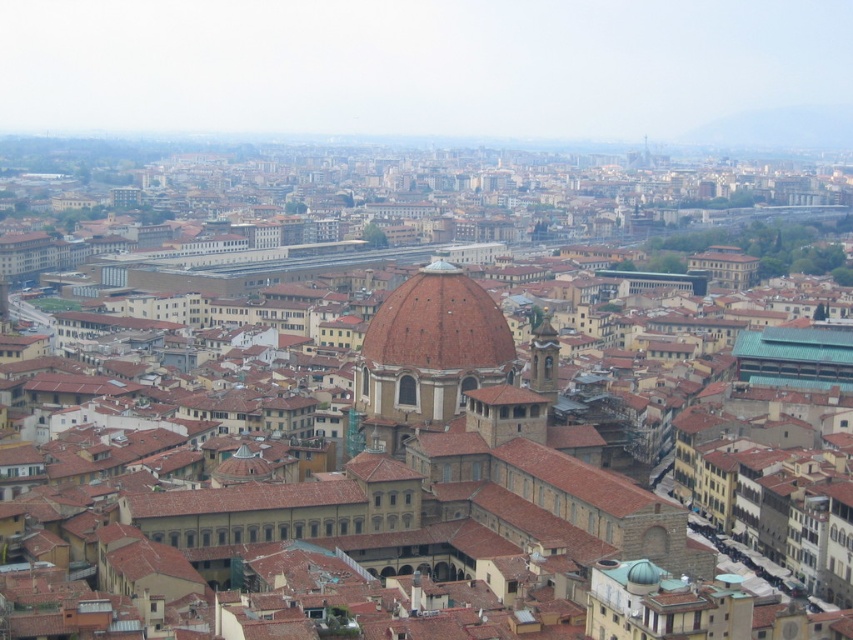
Question: Which object is farther from the camera taking this photo?

Choices:
 (A) golden stone tower at center-right
 (B) brown matte dome at center

Answer: (A)

Question: Is brown matte dome at center smaller than golden stone tower at center-right?

Choices:
 (A) yes
 (B) no

Answer: (A)

Question: Is brown matte dome at center above golden stone tower at center-right?

Choices:
 (A) no
 (B) yes

Answer: (B)

Question: Which point is closer to the camera taking this photo?

Choices:
 (A) (387, 333)
 (B) (544, 372)

Answer: (A)

Question: Which object is closer to the camera taking this photo?

Choices:
 (A) golden stone tower at center-right
 (B) brown matte dome at center

Answer: (B)

Question: Does brown matte dome at center appear over golden stone tower at center-right?

Choices:
 (A) yes
 (B) no

Answer: (A)